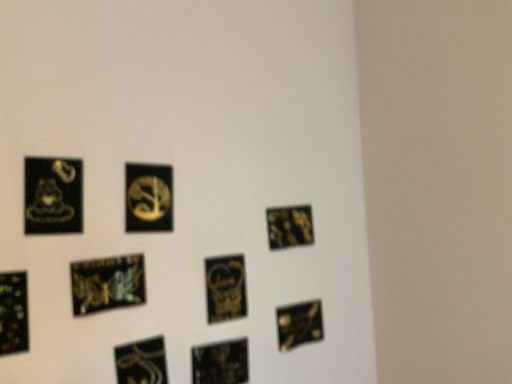
Question: From the image's perspective, is glossy black picture frame at lower left, the third picture frame positioned from the left, below metallic gold picture frame at lower left, the 9th picture frame viewed from the right?

Choices:
 (A) no
 (B) yes

Answer: (A)

Question: Is glossy black picture frame at lower left, the 7th picture frame positioned from the right, at the left side of metallic gold picture frame at lower left, the 9th picture frame viewed from the right?

Choices:
 (A) no
 (B) yes

Answer: (A)

Question: Is glossy black picture frame at lower left, the third picture frame positioned from the left, turned away from metallic gold picture frame at lower left, the first picture frame viewed from the left?

Choices:
 (A) no
 (B) yes

Answer: (A)

Question: Considering the relative sizes of glossy black picture frame at lower left, the 7th picture frame positioned from the right, and metallic gold picture frame at lower left, the 9th picture frame viewed from the right, in the image provided, is glossy black picture frame at lower left, the 7th picture frame positioned from the right, bigger than metallic gold picture frame at lower left, the 9th picture frame viewed from the right,?

Choices:
 (A) yes
 (B) no

Answer: (A)

Question: Could metallic gold picture frame at lower left, the first picture frame viewed from the left, be considered to be inside glossy black picture frame at lower left, the third picture frame positioned from the left?

Choices:
 (A) no
 (B) yes

Answer: (A)

Question: Is black glossy sticker at lower left, positioned as the sixth picture frame in right-to-left order, bigger or smaller than glossy black picture frame at lower left, the third picture frame positioned from the left?

Choices:
 (A) small
 (B) big

Answer: (A)

Question: In the image, is black glossy sticker at lower left, positioned as the sixth picture frame in right-to-left order, positioned in front of or behind glossy black picture frame at lower left, the third picture frame positioned from the left?

Choices:
 (A) front
 (B) behind

Answer: (B)

Question: Does point (151, 382) appear closer or farther from the camera than point (75, 311)?

Choices:
 (A) closer
 (B) farther

Answer: (B)

Question: In terms of width, does black glossy sticker at lower left, which is the 4th picture frame from left to right, look wider or thinner when compared to glossy black picture frame at lower left, the 7th picture frame positioned from the right?

Choices:
 (A) wide
 (B) thin

Answer: (B)

Question: From a real-world perspective, relative to black glossy sticker at lower left, positioned as the sixth picture frame in right-to-left order, is matte black coffee cup at left, which is the 8th picture frame in right-to-left order, vertically above or below?

Choices:
 (A) above
 (B) below

Answer: (A)

Question: In terms of width, does matte black coffee cup at left, which is the 8th picture frame in right-to-left order, look wider or thinner when compared to black glossy sticker at lower left, positioned as the sixth picture frame in right-to-left order?

Choices:
 (A) thin
 (B) wide

Answer: (A)

Question: Looking at the image, does matte black coffee cup at left, which ranks as the 2th picture frame in left-to-right order, seem bigger or smaller compared to black glossy sticker at lower left, positioned as the sixth picture frame in right-to-left order?

Choices:
 (A) small
 (B) big

Answer: (A)

Question: Is matte black coffee cup at left, which ranks as the 2th picture frame in left-to-right order, to the left or to the right of black glossy sticker at lower left, positioned as the sixth picture frame in right-to-left order, in the image?

Choices:
 (A) right
 (B) left

Answer: (B)

Question: Choose the correct answer: Is metallic gold picture frame at center-right, which is the 2th picture frame from right to left, inside black glossy sticker at lower left, which is the 4th picture frame from left to right, or outside it?

Choices:
 (A) inside
 (B) outside

Answer: (B)

Question: Considering the positions of point (x=289, y=220) and point (x=117, y=377), is point (x=289, y=220) closer or farther from the camera than point (x=117, y=377)?

Choices:
 (A) closer
 (B) farther

Answer: (B)